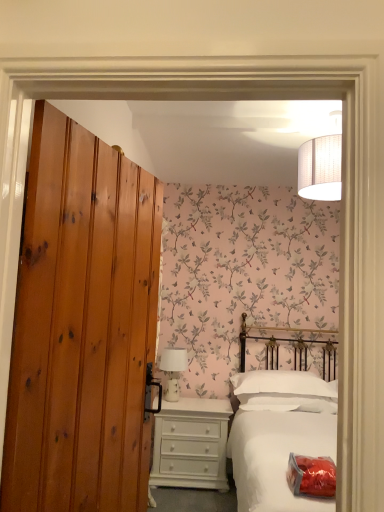
Question: Is white matte bed at center far away from white soft pillow at center?

Choices:
 (A) yes
 (B) no

Answer: (B)

Question: Does white matte bed at center appear on the left side of white soft pillow at center?

Choices:
 (A) yes
 (B) no

Answer: (B)

Question: Is white matte bed at center facing away from white soft pillow at center?

Choices:
 (A) yes
 (B) no

Answer: (A)

Question: Is white matte bed at center not within white soft pillow at center?

Choices:
 (A) yes
 (B) no

Answer: (A)

Question: From the image's perspective, is white matte bed at center over white soft pillow at center?

Choices:
 (A) yes
 (B) no

Answer: (B)

Question: From the image's perspective, is white ceramic table lamp at center above or below knotty pine door at left?

Choices:
 (A) below
 (B) above

Answer: (A)

Question: Is white ceramic table lamp at center wider or thinner than knotty pine door at left?

Choices:
 (A) thin
 (B) wide

Answer: (B)

Question: Is point (183, 362) closer or farther from the camera than point (125, 449)?

Choices:
 (A) farther
 (B) closer

Answer: (A)

Question: Relative to knotty pine door at left, is white ceramic table lamp at center in front or behind?

Choices:
 (A) behind
 (B) front

Answer: (A)

Question: Considering the relative positions of white matte bed at center and white ceramic table lamp at center in the image provided, is white matte bed at center to the left or to the right of white ceramic table lamp at center?

Choices:
 (A) right
 (B) left

Answer: (A)

Question: Considering their positions, is white matte bed at center located in front of or behind white ceramic table lamp at center?

Choices:
 (A) front
 (B) behind

Answer: (A)

Question: Looking at their shapes, would you say white matte bed at center is wider or thinner than white ceramic table lamp at center?

Choices:
 (A) thin
 (B) wide

Answer: (B)

Question: In terms of size, does white matte bed at center appear bigger or smaller than white ceramic table lamp at center?

Choices:
 (A) small
 (B) big

Answer: (B)

Question: Would you say knotty pine door at left is inside or outside white ceramic table lamp at center?

Choices:
 (A) inside
 (B) outside

Answer: (B)

Question: Considering their positions, is knotty pine door at left located in front of or behind white ceramic table lamp at center?

Choices:
 (A) front
 (B) behind

Answer: (A)